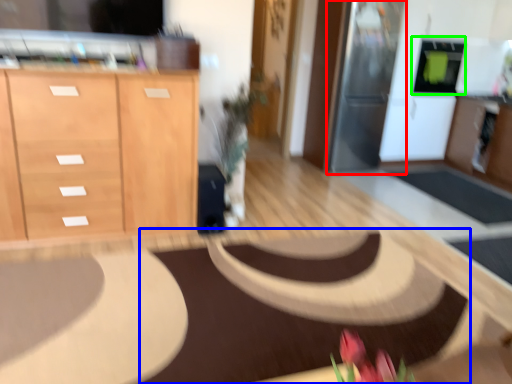
Question: Which is farther away from appliance (highlighted by a red box)? mat (highlighted by a blue box) or appliance (highlighted by a green box)?

Choices:
 (A) mat
 (B) appliance

Answer: (A)